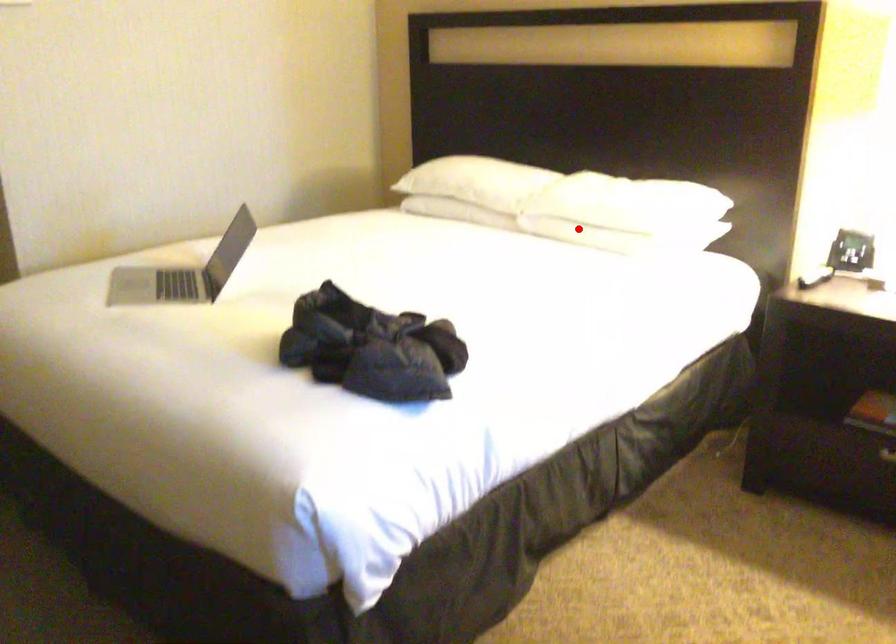
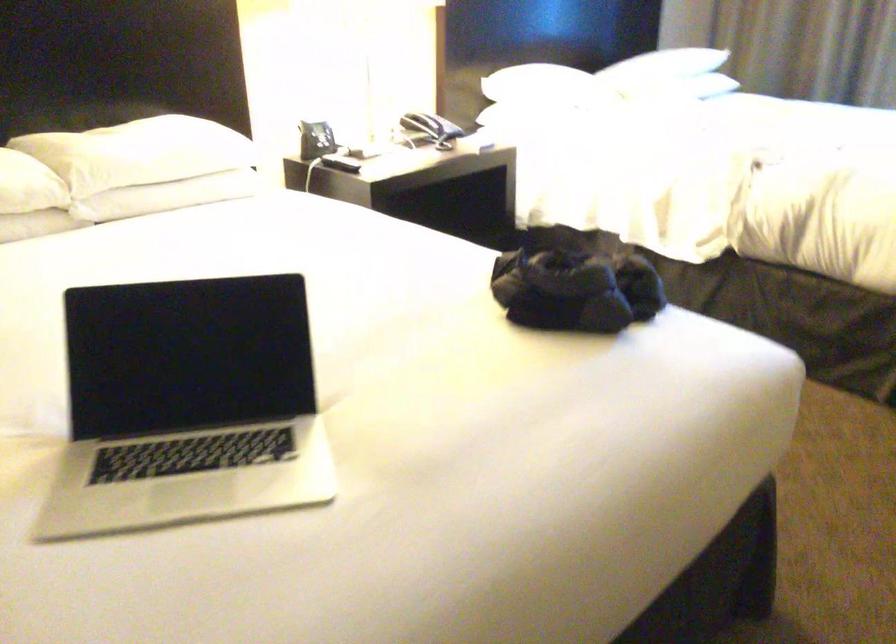
Find the pixel in the second image that matches the highlighted location in the first image.

(167, 196)